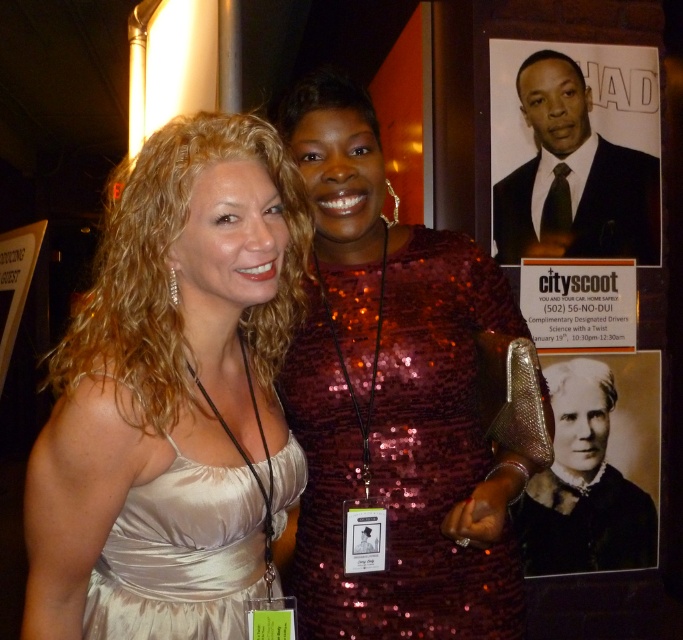
You are standing in front of the poster at the event. There are two points marked on the poster. The first point is at coordinate point (210, 298) and the second point is at coordinate point (370, 620). Which point is closer to you?

Point (210, 298) is closer to the viewer than point (370, 620).

You are a photographer at an event and need to position two models for a group photo. The models are wearing the satin dress at left and the satin dress at center. Based on their current positions, which model wearing which dress should you move to the right to align them side by side?

The satin dress at left is currently to the left of the satin dress at center. To align them side by side, move the model wearing the satin dress at left to the right so that both are positioned next to each other.

You are an event photographer who needs to capture a photo of the satin dress at center and the black matte portrait at upper right in the background. However, your camera can only focus on one subject at a time. Based on their positions, which subject should you focus on first to ensure it appears sharp in the photo?

The satin dress at center is above the black matte portrait at upper right, so focusing on the satin dress at center first will ensure it is sharp since it is closer to the camera.